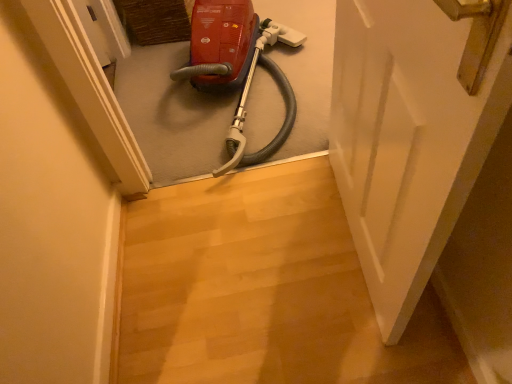
Identify the location of matte red vacuum cleaner at center. This screenshot has width=512, height=384. (237, 66).

The width and height of the screenshot is (512, 384). Describe the element at coordinates (237, 66) in the screenshot. I see `matte red vacuum cleaner at center` at that location.

What do you see at coordinates (413, 131) in the screenshot? I see `white matte door at center` at bounding box center [413, 131].

Where is `white matte door at center`? This screenshot has width=512, height=384. white matte door at center is located at coordinates (413, 131).

This screenshot has width=512, height=384. What are the coordinates of `matte red vacuum cleaner at center` in the screenshot? It's located at (237, 66).

In the image, is white matte door at center on the left side or the right side of matte red vacuum cleaner at center?

Based on their positions, white matte door at center is located to the right of matte red vacuum cleaner at center.

Which is in front, white matte door at center or matte red vacuum cleaner at center?

white matte door at center is in front.

Which is in front, point (502, 26) or point (207, 55)?

The point (502, 26) is more forward.

From the image's perspective, does white matte door at center appear lower than matte red vacuum cleaner at center?

Yes.

From a real-world perspective, is white matte door at center physically above matte red vacuum cleaner at center?

Indeed, from a real-world perspective, white matte door at center stands above matte red vacuum cleaner at center.

Does white matte door at center have a lesser width compared to matte red vacuum cleaner at center?

Correct, the width of white matte door at center is less than that of matte red vacuum cleaner at center.

Does white matte door at center have a lesser height compared to matte red vacuum cleaner at center?

No.

Considering the relative sizes of white matte door at center and matte red vacuum cleaner at center in the image provided, is white matte door at center smaller than matte red vacuum cleaner at center?

Correct, white matte door at center occupies less space than matte red vacuum cleaner at center.

Is white matte door at center not within matte red vacuum cleaner at center?

Yes, white matte door at center is not within matte red vacuum cleaner at center.

Would you consider white matte door at center to be distant from matte red vacuum cleaner at center?

white matte door at center is near matte red vacuum cleaner at center, not far away.

Is white matte door at center positioned with its back to matte red vacuum cleaner at center?

No, white matte door at center's orientation is not away from matte red vacuum cleaner at center.

Where is `equipment behind the white matte door at center`? The height and width of the screenshot is (384, 512). equipment behind the white matte door at center is located at coordinates (237, 66).

Considering the relative positions of matte red vacuum cleaner at center and white matte door at center in the image provided, is matte red vacuum cleaner at center to the left of white matte door at center from the viewer's perspective?

Indeed, matte red vacuum cleaner at center is positioned on the left side of white matte door at center.

Does matte red vacuum cleaner at center lie behind white matte door at center?

Yes.

Is point (236, 8) in front of point (482, 123)?

No.

From the image's perspective, is matte red vacuum cleaner at center located above or below white matte door at center?

matte red vacuum cleaner at center is above white matte door at center.

From a real-world perspective, which is physically above, matte red vacuum cleaner at center or white matte door at center?

white matte door at center, from a real-world perspective.

Between matte red vacuum cleaner at center and white matte door at center, which one has smaller width?

white matte door at center is thinner.

Considering the sizes of matte red vacuum cleaner at center and white matte door at center in the image, is matte red vacuum cleaner at center taller or shorter than white matte door at center?

matte red vacuum cleaner at center is shorter than white matte door at center.

Considering the sizes of objects matte red vacuum cleaner at center and white matte door at center in the image provided, who is bigger, matte red vacuum cleaner at center or white matte door at center?

With larger size is matte red vacuum cleaner at center.

Is matte red vacuum cleaner at center situated inside white matte door at center or outside?

The correct answer is: outside.

Is matte red vacuum cleaner at center in contact with white matte door at center?

matte red vacuum cleaner at center and white matte door at center are clearly separated.

Could you tell me if matte red vacuum cleaner at center is turned towards white matte door at center?

No, matte red vacuum cleaner at center is not oriented towards white matte door at center.

At what (x,y) coordinates should I click in order to perform the action: click on door in front of the matte red vacuum cleaner at center. Please return your answer as a coordinate pair (x, y). Looking at the image, I should click on (413, 131).

Identify the location of door lying in front of the matte red vacuum cleaner at center. (413, 131).

What are the coordinates of `door above the matte red vacuum cleaner at center (from a real-world perspective)` in the screenshot? It's located at (413, 131).